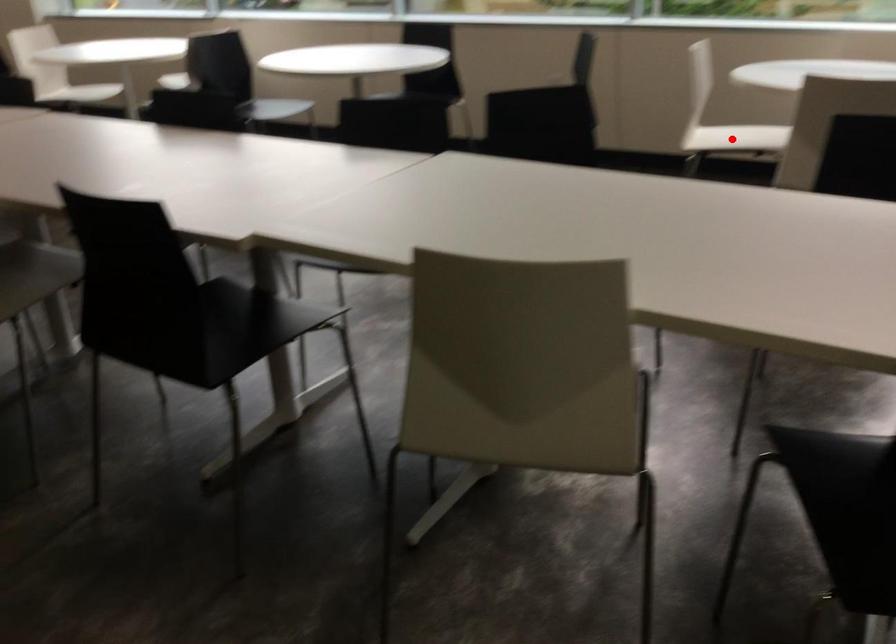
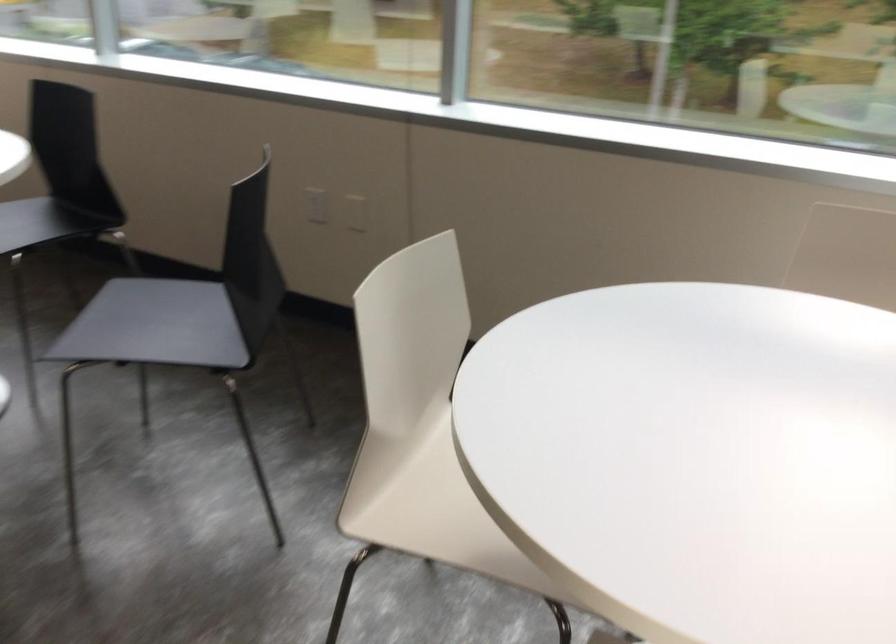
The point at the highlighted location is marked in the first image. Where is the corresponding point in the second image?

(431, 509)